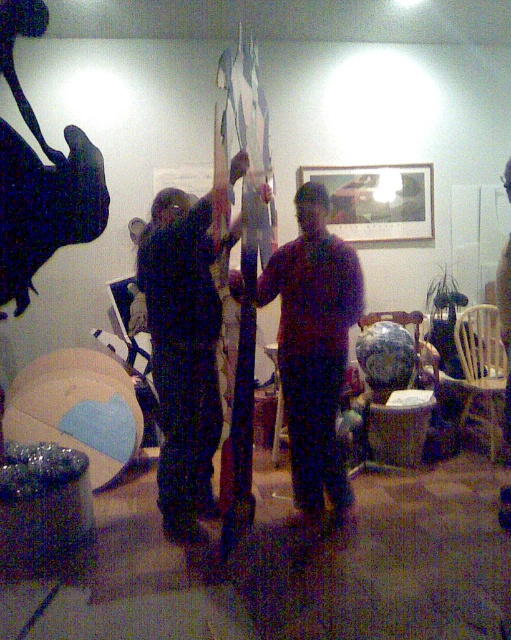
Which is in front, point (160, 244) or point (295, 483)?

Point (160, 244)

Is point (205, 483) closer to camera compared to point (334, 268)?

No, it is not.

Find the location of a particular element. This screenshot has height=640, width=511. black fabric pants at center is located at coordinates (184, 349).